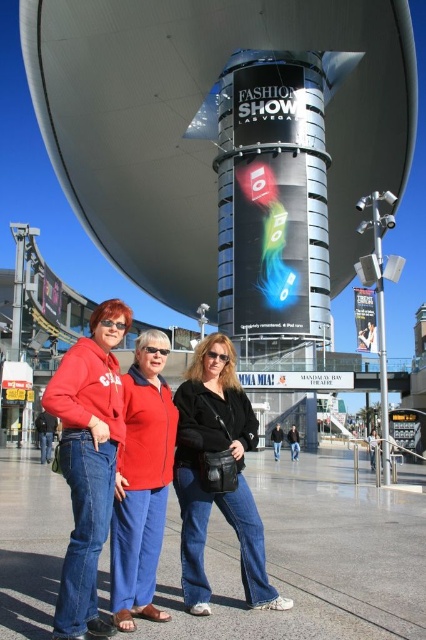
Question: Does matte red hoodie at center have a smaller size compared to matte black jacket at center?

Choices:
 (A) no
 (B) yes

Answer: (B)

Question: Is matte red hoodie at center positioned behind matte black jacket at center?

Choices:
 (A) yes
 (B) no

Answer: (B)

Question: Which point is farther to the camera?

Choices:
 (A) (x=218, y=365)
 (B) (x=129, y=474)

Answer: (A)

Question: Which is farther from the matte red hoodie at center?

Choices:
 (A) matte black jacket at center
 (B) matte red jacket at center

Answer: (A)

Question: Can you confirm if matte red hoodie at center is positioned above matte red jacket at center?

Choices:
 (A) yes
 (B) no

Answer: (B)

Question: Which point is closer to the camera?

Choices:
 (A) matte red hoodie at center
 (B) matte black jacket at center
 (C) matte red jacket at center

Answer: (A)